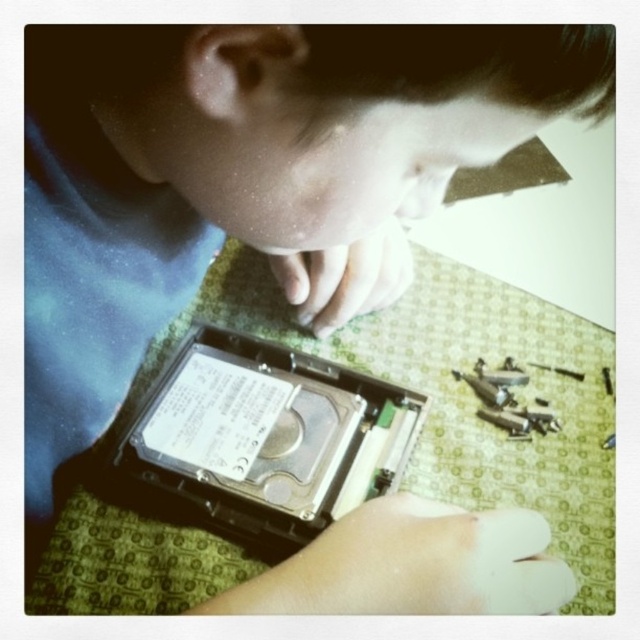
Question: Can you confirm if white matte hand at lower center is positioned below matte black hard drive at center?

Choices:
 (A) no
 (B) yes

Answer: (B)

Question: Can you confirm if white matte hand at lower center is smaller than matte black hard drive at center?

Choices:
 (A) yes
 (B) no

Answer: (A)

Question: Does white matte hand at lower center have a larger size compared to matte black hard drive at center?

Choices:
 (A) no
 (B) yes

Answer: (A)

Question: Which point is farther to the camera?

Choices:
 (A) (381, 305)
 (B) (230, 602)

Answer: (A)